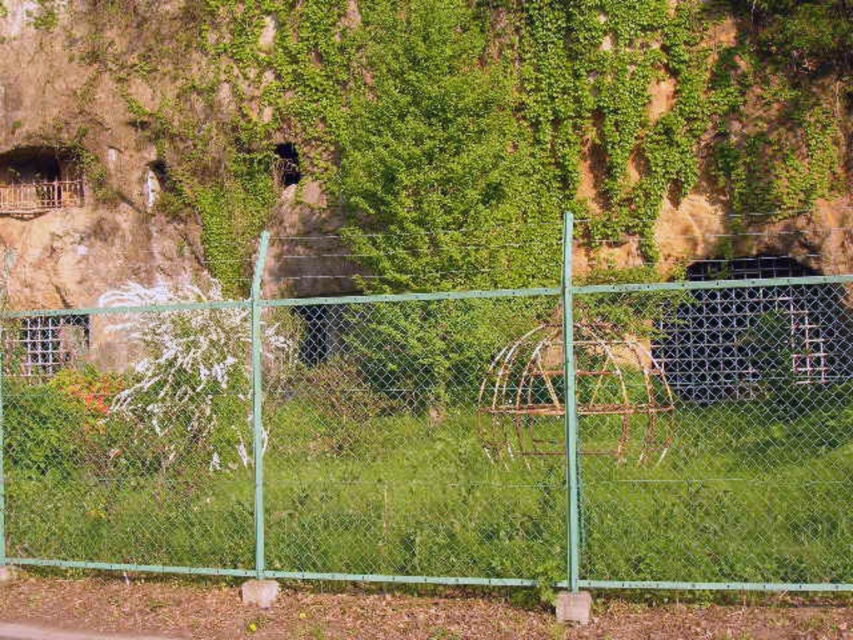
Can you confirm if green chain-link fence at center is positioned below green ivy-covered cliff at upper center?

Indeed, green chain-link fence at center is positioned under green ivy-covered cliff at upper center.

Consider the image. Who is more forward, (x=527, y=560) or (x=236, y=17)?

Positioned in front is point (x=527, y=560).

What do you see at coordinates (448, 436) in the screenshot? I see `green chain-link fence at center` at bounding box center [448, 436].

Find the location of a particular element. The width and height of the screenshot is (853, 640). green chain-link fence at center is located at coordinates (448, 436).